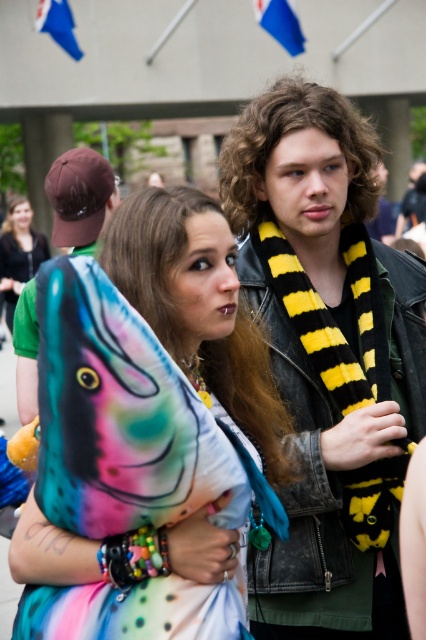
The width and height of the screenshot is (426, 640). I want to click on multicolored plush fish at center, so click(x=149, y=420).

Based on the photo, is the position of multicolored plush fish at center more distant than that of shiny yellow scarf at center?

No, it is not.

What do you see at coordinates (149, 420) in the screenshot? The width and height of the screenshot is (426, 640). I see `multicolored plush fish at center` at bounding box center [149, 420].

Locate an element on the screen. multicolored plush fish at center is located at coordinates (149, 420).

Does multicolored plush fish at center have a lesser height compared to black knitted scarf at center?

Yes.

Does point (255, 381) come in front of point (328, 316)?

Yes, point (255, 381) is closer to viewer.

Locate an element on the screen. The image size is (426, 640). multicolored plush fish at center is located at coordinates (149, 420).

Can you confirm if black knitted scarf at center is shorter than matte green t-shirt at left?

In fact, black knitted scarf at center may be taller than matte green t-shirt at left.

Where is `black knitted scarf at center`? The width and height of the screenshot is (426, 640). black knitted scarf at center is located at coordinates (328, 358).

What do you see at coordinates (328, 358) in the screenshot? The height and width of the screenshot is (640, 426). I see `black knitted scarf at center` at bounding box center [328, 358].

At what (x,y) coordinates should I click in order to perform the action: click on black knitted scarf at center. Please return your answer as a coordinate pair (x, y). Looking at the image, I should click on (328, 358).